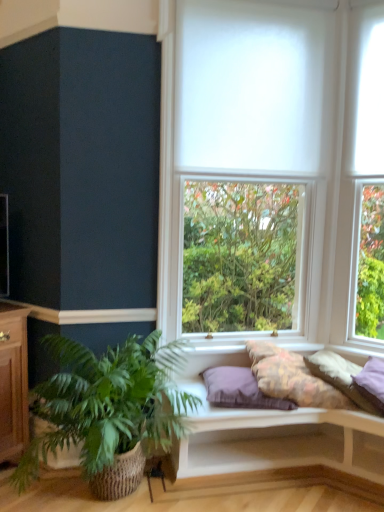
Question: From the image's perspective, would you say purple fabric pillow at center, which ranks as the 3th pillow in right-to-left order, is positioned over white cushioned bench at lower center?

Choices:
 (A) yes
 (B) no

Answer: (A)

Question: Does purple fabric pillow at center, which is the 1th pillow from left to right, appear on the left side of white cushioned bench at lower center?

Choices:
 (A) no
 (B) yes

Answer: (B)

Question: Is purple fabric pillow at center, which is the 1th pillow from left to right, to the right of white cushioned bench at lower center from the viewer's perspective?

Choices:
 (A) no
 (B) yes

Answer: (A)

Question: Is purple fabric pillow at center, which is the 1th pillow from left to right, thinner than white cushioned bench at lower center?

Choices:
 (A) yes
 (B) no

Answer: (A)

Question: From a real-world perspective, is purple fabric pillow at center, which is the 1th pillow from left to right, positioned over white cushioned bench at lower center based on gravity?

Choices:
 (A) no
 (B) yes

Answer: (B)

Question: Visually, is white cushioned bench at lower center positioned to the left or to the right of fluffy cotton pillow at center, which is the 2th pillow in right-to-left order?

Choices:
 (A) left
 (B) right

Answer: (A)

Question: Considering their positions, is white cushioned bench at lower center located in front of or behind fluffy cotton pillow at center, which is the 2th pillow in right-to-left order?

Choices:
 (A) front
 (B) behind

Answer: (A)

Question: Looking at their shapes, would you say white cushioned bench at lower center is wider or thinner than fluffy cotton pillow at center, which is the 2th pillow in right-to-left order?

Choices:
 (A) wide
 (B) thin

Answer: (A)

Question: Considering the positions of white cushioned bench at lower center and fluffy cotton pillow at center, the second pillow in the left-to-right sequence, in the image, is white cushioned bench at lower center taller or shorter than fluffy cotton pillow at center, the second pillow in the left-to-right sequence,?

Choices:
 (A) tall
 (B) short

Answer: (A)

Question: From the image's perspective, relative to white matte window at center, is purple fabric pillow at center, which is the 1th pillow from left to right, above or below?

Choices:
 (A) above
 (B) below

Answer: (B)

Question: Considering the positions of purple fabric pillow at center, which is the 1th pillow from left to right, and white matte window at center in the image, is purple fabric pillow at center, which is the 1th pillow from left to right, taller or shorter than white matte window at center?

Choices:
 (A) tall
 (B) short

Answer: (B)

Question: From a real-world perspective, is purple fabric pillow at center, which ranks as the 3th pillow in right-to-left order, positioned above or below white matte window at center?

Choices:
 (A) above
 (B) below

Answer: (B)

Question: Based on their positions, is purple fabric pillow at center, which is the 1th pillow from left to right, located to the left or right of white matte window at center?

Choices:
 (A) right
 (B) left

Answer: (B)

Question: From the image's perspective, relative to purple fabric pillow at center, which is the 1th pillow from left to right, is white cushioned bench at lower center above or below?

Choices:
 (A) above
 (B) below

Answer: (B)

Question: In the image, is white cushioned bench at lower center on the left side or the right side of purple fabric pillow at center, which is the 1th pillow from left to right?

Choices:
 (A) left
 (B) right

Answer: (B)